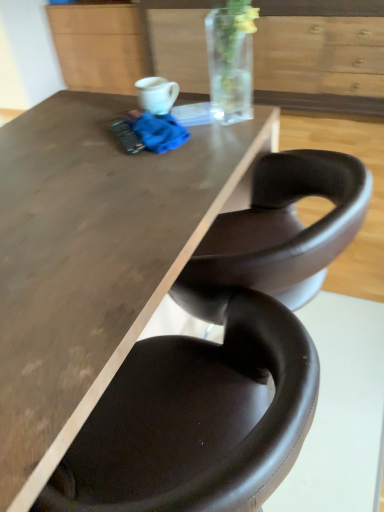
Question: From the image's perspective, does matte brown table at center appear higher than matte wood cabinet at upper center?

Choices:
 (A) no
 (B) yes

Answer: (A)

Question: Is matte brown table at center wider than matte wood cabinet at upper center?

Choices:
 (A) no
 (B) yes

Answer: (B)

Question: Is matte brown table at center completely or partially outside of matte wood cabinet at upper center?

Choices:
 (A) yes
 (B) no

Answer: (A)

Question: Is matte brown table at center bigger than matte wood cabinet at upper center?

Choices:
 (A) yes
 (B) no

Answer: (A)

Question: Considering the relative positions of matte brown table at center and matte wood cabinet at upper center in the image provided, is matte brown table at center to the right of matte wood cabinet at upper center from the viewer's perspective?

Choices:
 (A) yes
 (B) no

Answer: (A)

Question: From a real-world perspective, is brown leather chair at lower center above or below white glossy mug at upper center?

Choices:
 (A) below
 (B) above

Answer: (A)

Question: Choose the correct answer: Is brown leather chair at lower center inside white glossy mug at upper center or outside it?

Choices:
 (A) outside
 (B) inside

Answer: (A)

Question: Is brown leather chair at lower center in front of or behind white glossy mug at upper center in the image?

Choices:
 (A) behind
 (B) front

Answer: (B)

Question: Looking at their shapes, would you say brown leather chair at lower center is wider or thinner than white glossy mug at upper center?

Choices:
 (A) thin
 (B) wide

Answer: (B)

Question: Is white glossy mug at upper center situated inside wooden drawer at upper center or outside?

Choices:
 (A) inside
 (B) outside

Answer: (B)

Question: From a real-world perspective, is white glossy mug at upper center physically located above or below wooden drawer at upper center?

Choices:
 (A) below
 (B) above

Answer: (B)

Question: Considering the positions of point (147, 83) and point (279, 89), is point (147, 83) closer or farther from the camera than point (279, 89)?

Choices:
 (A) farther
 (B) closer

Answer: (B)

Question: Is white glossy mug at upper center to the left or to the right of wooden drawer at upper center in the image?

Choices:
 (A) left
 (B) right

Answer: (A)

Question: Is white glossy mug at upper center taller or shorter than matte wood cabinet at upper center?

Choices:
 (A) tall
 (B) short

Answer: (B)

Question: From the image's perspective, relative to matte wood cabinet at upper center, is white glossy mug at upper center above or below?

Choices:
 (A) below
 (B) above

Answer: (A)